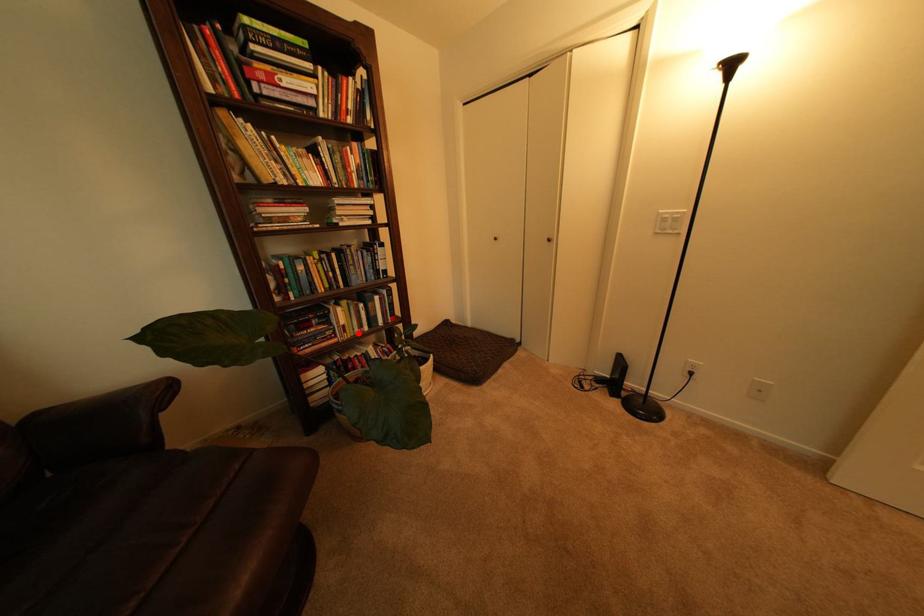
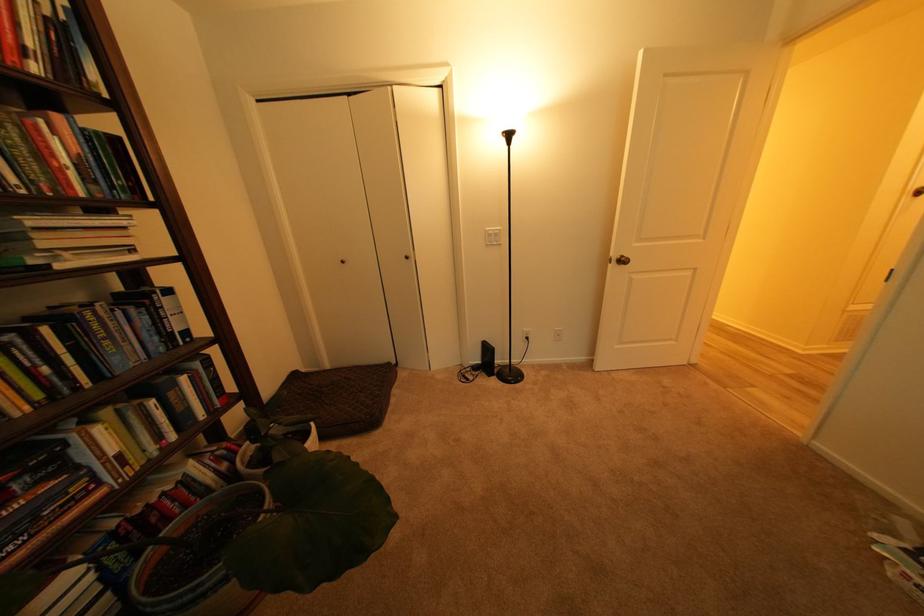
Locate, in the second image, the point that corresponds to the highlighted location in the first image.

(141, 463)